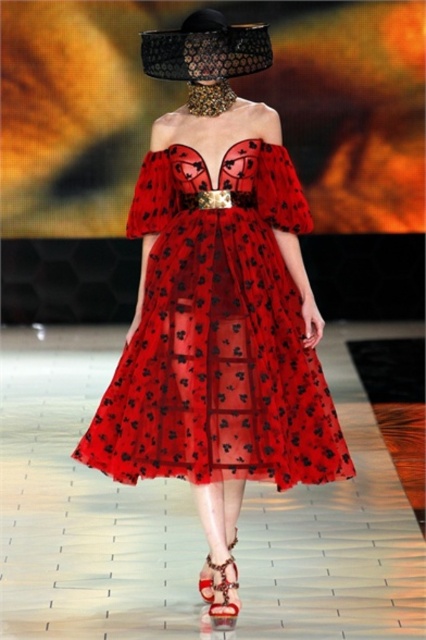
You are a photographer positioned at the origin of the runway. You want to capture the translucent red dress at center in your shot. What are the coordinates of the dress relative to your position?

The coordinates of the translucent red dress at center are at point [218,333] relative to your position.

You are a photographer positioned at the runway entrance. The model in the translucent red dress at center is walking towards you. The runway is 3 meters long. Can you capture the model before they reach the end of the runway?

The model in the translucent red dress at center is 2.80 meters away from you. Since the runway is 3 meters long, the model will reach the end of the runway before you can capture them. You need to move closer or wait for the next pass.